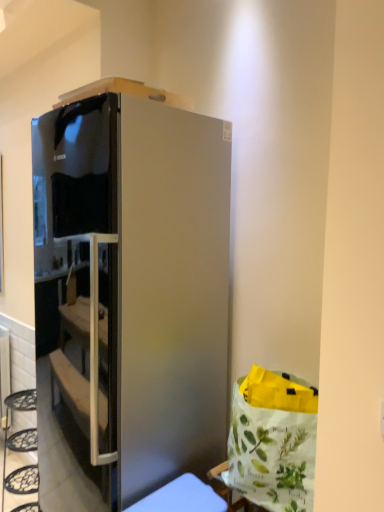
In order to face satin silver refrigerator at center, should I rotate leftwards or rightwards?

Rotate your view left by about 9.062°.

The height and width of the screenshot is (512, 384). In order to click on satin silver refrigerator at center in this screenshot , I will do `click(135, 277)`.

The height and width of the screenshot is (512, 384). Describe the element at coordinates (135, 277) in the screenshot. I see `satin silver refrigerator at center` at that location.

Describe the element at coordinates (181, 497) in the screenshot. I see `satin silver fridge at lower center` at that location.

The width and height of the screenshot is (384, 512). I want to click on satin silver fridge at lower center, so click(x=181, y=497).

What are the coordinates of `satin silver refrigerator at center` in the screenshot? It's located at (135, 277).

Does satin silver fridge at lower center appear on the left side of satin silver refrigerator at center?

No.

Between satin silver fridge at lower center and satin silver refrigerator at center, which one is positioned behind?

satin silver refrigerator at center is behind.

Does point (150, 499) appear closer or farther from the camera than point (132, 223)?

Point (150, 499) is farther from the camera than point (132, 223).

From the image's perspective, between satin silver fridge at lower center and satin silver refrigerator at center, which one is located above?

satin silver refrigerator at center appears higher in the image.

From a real-world perspective, is satin silver fridge at lower center physically above satin silver refrigerator at center?

No, from a real-world perspective, satin silver fridge at lower center is not over satin silver refrigerator at center

Consider the image. Is satin silver fridge at lower center thinner than satin silver refrigerator at center?

Yes, satin silver fridge at lower center is thinner than satin silver refrigerator at center.

Is satin silver fridge at lower center shorter than satin silver refrigerator at center?

Yes, satin silver fridge at lower center is shorter than satin silver refrigerator at center.

Which of these two, satin silver fridge at lower center or satin silver refrigerator at center, is smaller?

Smaller between the two is satin silver fridge at lower center.

Is satin silver fridge at lower center located outside satin silver refrigerator at center?

Yes.

Does satin silver fridge at lower center touch satin silver refrigerator at center?

No.

Could you tell me if satin silver fridge at lower center is turned towards satin silver refrigerator at center?

No, satin silver fridge at lower center is not facing towards satin silver refrigerator at center.

Image resolution: width=384 pixels, height=512 pixels. What are the coordinates of `cabinetry behind the satin silver fridge at lower center` in the screenshot? It's located at (135, 277).

Which is more to the left, satin silver refrigerator at center or satin silver fridge at lower center?

satin silver refrigerator at center.

Which object is closer to the camera taking this photo, satin silver refrigerator at center or satin silver fridge at lower center?

Positioned in front is satin silver fridge at lower center.

Considering the positions of points (224, 376) and (162, 511), is point (224, 376) closer to camera compared to point (162, 511)?

No, (224, 376) is behind (162, 511).

From the image's perspective, who appears lower, satin silver refrigerator at center or satin silver fridge at lower center?

satin silver fridge at lower center appears lower in the image.

From a real-world perspective, is satin silver refrigerator at center physically located above or below satin silver fridge at lower center?

satin silver refrigerator at center is situated higher than satin silver fridge at lower center in the real world.

Can you confirm if satin silver refrigerator at center is wider than satin silver fridge at lower center?

Indeed, satin silver refrigerator at center has a greater width compared to satin silver fridge at lower center.

Based on the photo, can you confirm if satin silver refrigerator at center is shorter than satin silver fridge at lower center?

No, satin silver refrigerator at center is not shorter than satin silver fridge at lower center.

Looking at the image, does satin silver refrigerator at center seem bigger or smaller compared to satin silver fridge at lower center?

Considering their sizes, satin silver refrigerator at center takes up more space than satin silver fridge at lower center.

Consider the image. Would you say satin silver refrigerator at center contains satin silver fridge at lower center?

That's incorrect, satin silver fridge at lower center is not inside satin silver refrigerator at center.

Are satin silver refrigerator at center and satin silver fridge at lower center making contact?

No.

Could you tell me if satin silver refrigerator at center is facing satin silver fridge at lower center?

No, satin silver refrigerator at center is not facing towards satin silver fridge at lower center.

Locate an element on the screen. cabinetry on the left of satin silver fridge at lower center is located at coordinates (135, 277).

Locate an element on the screen. This screenshot has width=384, height=512. furniture directly beneath the satin silver refrigerator at center (from a real-world perspective) is located at coordinates (181, 497).

This screenshot has width=384, height=512. In the image, there is a satin silver fridge at lower center. In order to click on cabinetry above it (from the image's perspective) in this screenshot , I will do `click(135, 277)`.